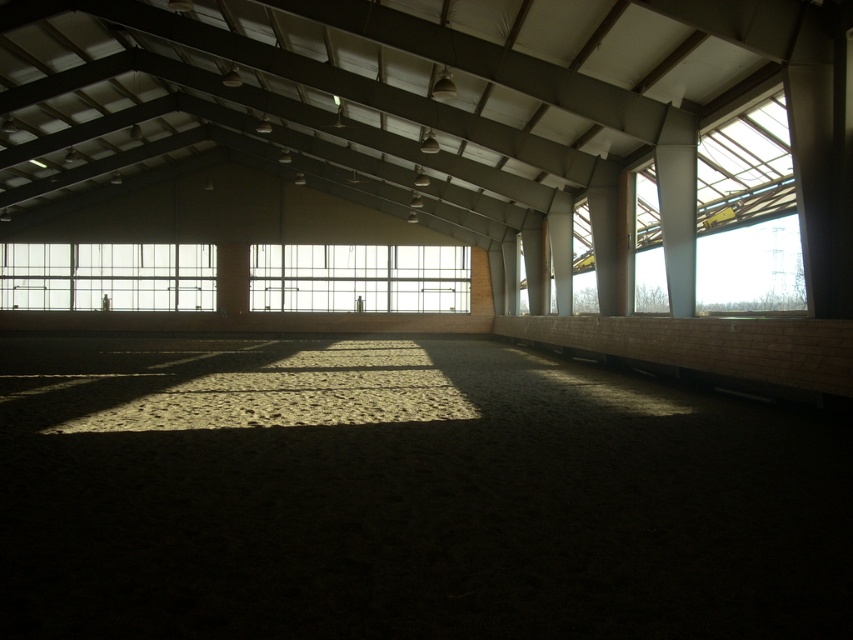
Consider the image. You are an architect designing a new lighting system for the arena. You need to install a light fixture between the transparent glass window at upper right and the clear glass window at upper left. Based on their positions, where should the light fixture be placed?

The transparent glass window at upper right is located below the clear glass window at upper left, so the light fixture should be placed between them, above the transparent glass window at upper right and below the clear glass window at upper left.

You are an event planner setting up for a conference in the arena. You need to place a 60 feet long banner between the transparent glass window at upper right and the clear glass window at center. Will the banner fit without overlapping either window?

The distance between the transparent glass window at upper right and the clear glass window at center is 65.30 feet. Since the banner is 60 feet long, it will fit between them without overlapping either window as there is an extra 5.30 feet of space.

In the scene shown: You are standing in the arena and want to look through both the clear glass window at center and the clear glass window at upper left. Which window would allow you to see outside the arena first as you move forward?

The clear glass window at upper left is behind the clear glass window at center, so you would first see through the clear glass window at center before the clear glass window at upper left as you move forward.